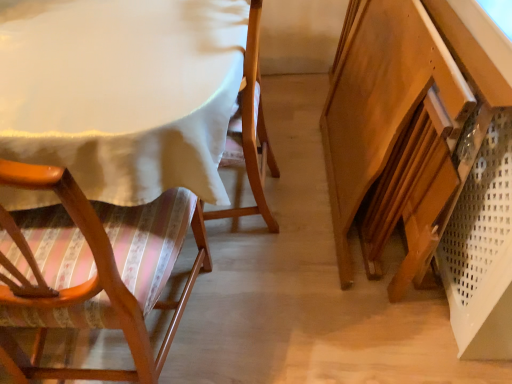
Question: In the image, is white fabric table at upper left positioned in front of or behind wooden chair with striped cushion at left?

Choices:
 (A) behind
 (B) front

Answer: (A)

Question: Considering the positions of white fabric table at upper left and wooden chair with striped cushion at left in the image, is white fabric table at upper left bigger or smaller than wooden chair with striped cushion at left?

Choices:
 (A) small
 (B) big

Answer: (B)

Question: Which of these objects is positioned farthest from the wooden vanity at lower right?

Choices:
 (A) wooden chair with striped cushion at left
 (B) white fabric table at upper left

Answer: (A)

Question: Which object is the closest to the wooden chair with striped cushion at left?

Choices:
 (A) wooden vanity at lower right
 (B) white fabric table at upper left

Answer: (B)